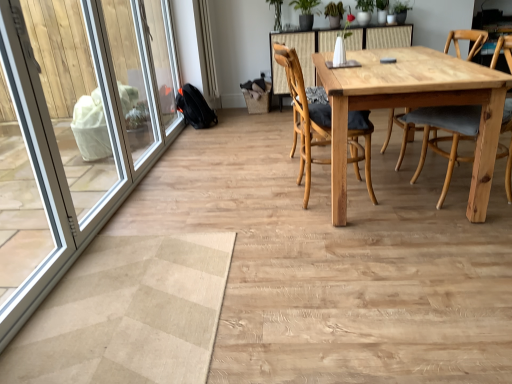
Locate an element on the screen. The height and width of the screenshot is (384, 512). vacant area to the right of wooden chair at center, which is the first chair from left to right is located at coordinates (396, 183).